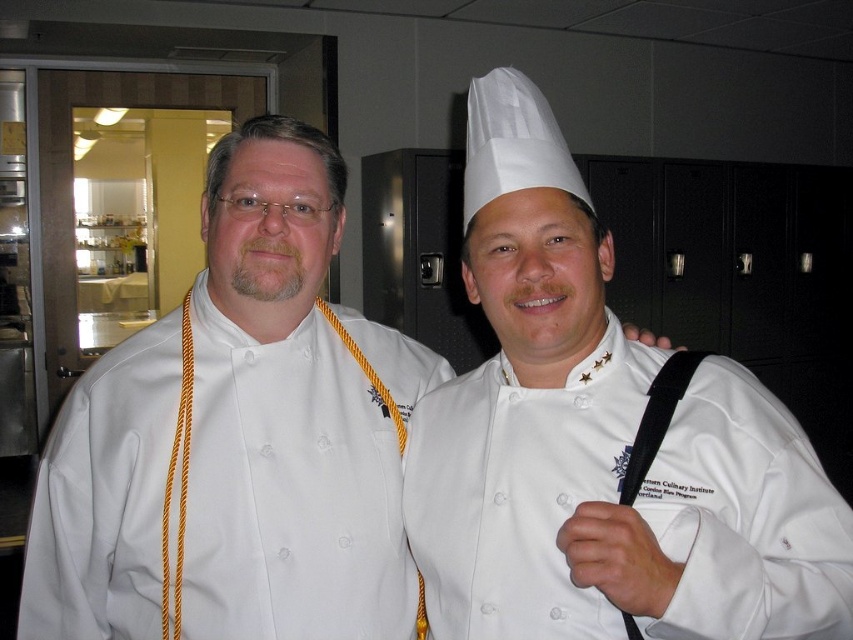
Question: Does white matte chef hat at upper center have a larger size compared to white chef coat at center?

Choices:
 (A) yes
 (B) no

Answer: (B)

Question: Which object is farther from the camera taking this photo?

Choices:
 (A) white matte chef hat at upper center
 (B) white chef coat at center

Answer: (B)

Question: Among these objects, which one is nearest to the camera?

Choices:
 (A) white chef coat at center
 (B) white matte chef hat at upper center

Answer: (B)

Question: Is white matte chef hat at upper center thinner than white chef coat at center?

Choices:
 (A) no
 (B) yes

Answer: (B)

Question: Is white matte chef hat at upper center thinner than white chef coat at center?

Choices:
 (A) yes
 (B) no

Answer: (A)